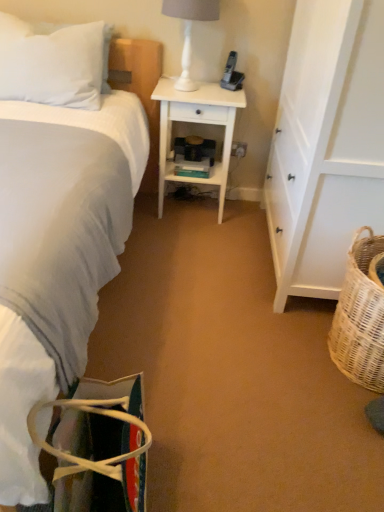
Where is `vacant space underneath white wood desk at center (from a real-world perspective)`? This screenshot has width=384, height=512. vacant space underneath white wood desk at center (from a real-world perspective) is located at coordinates (191, 210).